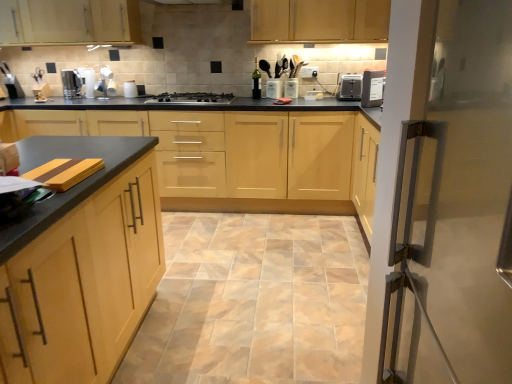
Question: Looking at their shapes, would you say light wood/veneer cabinets at center, the 2th cabinetry in the front-to-back sequence, is wider or thinner than matte wood cabinets at upper center, which is the third cabinetry from bottom to top?

Choices:
 (A) thin
 (B) wide

Answer: (B)

Question: Visually, is light wood/veneer cabinets at center, which is counted as the second cabinetry, starting from the bottom, positioned to the left or to the right of matte wood cabinets at upper center, which is the third cabinetry from bottom to top?

Choices:
 (A) left
 (B) right

Answer: (A)

Question: Based on their relative distances, which object is farther from the satin silver kettle at left?

Choices:
 (A) matte wood cabinets at upper center, which is the 3th cabinetry in front-to-back order
 (B) light wood/veneer cabinets at center, the 3th cabinetry viewed from the back
 (C) stainless steel gas stove at center
 (D) black plastic toaster at upper right
 (E) beige ceramic tile at center

Answer: (D)

Question: Which of these objects is positioned farthest from the stainless steel gas stove at center?

Choices:
 (A) light wood/veneer cabinets at center, arranged as the 3th cabinetry when viewed from the top
 (B) black plastic toaster at upper right
 (C) matte wood cabinets at upper center, which is the third cabinetry from bottom to top
 (D) white plastic toaster at upper right
 (E) light wood cabinet at upper center, the 1th cabinetry in the top-to-bottom sequence

Answer: (D)